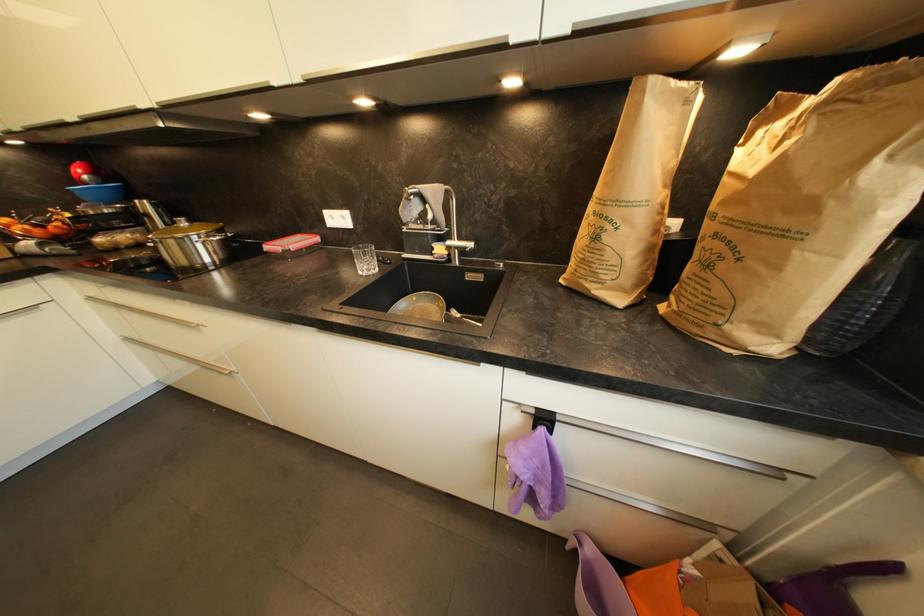
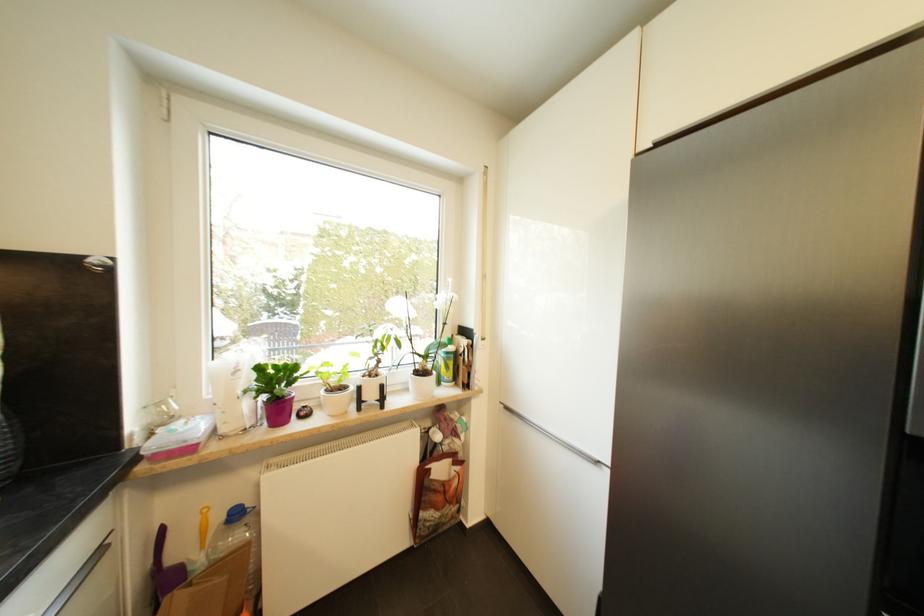
Locate, in the second image, the point that corresponds to (781,475) in the first image.

(105, 553)